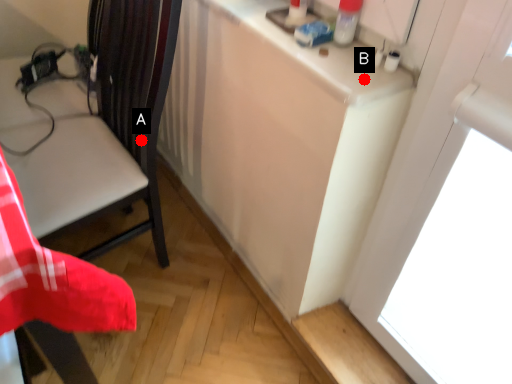
Question: Two points are circled on the image, labeled by A and B beside each circle. Which point is closer to the camera?

Choices:
 (A) A is closer
 (B) B is closer

Answer: (B)